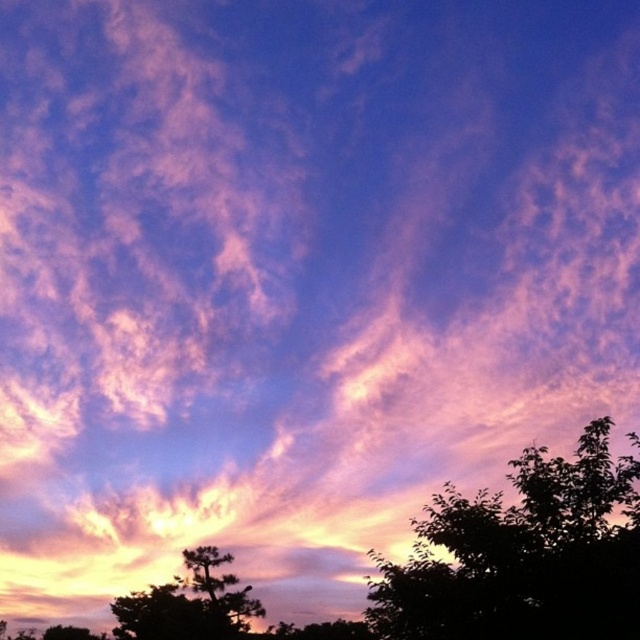
You are an artist painting the sunset scene. You want to place a bird flying between the silhouette leafy tree at lower right and the silhouette pine tree at lower left. Which tree should the bird be closer to based on their positions?

The silhouette leafy tree at lower right is to the right of the silhouette pine tree at lower left, so the bird should be closer to the silhouette pine tree at lower left since it is positioned to the left of the leafy tree.

You are a photographer planning to capture the sunset scene. You notice two trees in the foreground, the silhouette leafy tree at lower right and the silhouette pine tree at lower left. Which tree would you focus on if you want to emphasize the broader tree in your composition?

The silhouette leafy tree at lower right has a greater width than the silhouette pine tree at lower left, so focusing on the silhouette leafy tree at lower right would emphasize the broader tree in your composition.